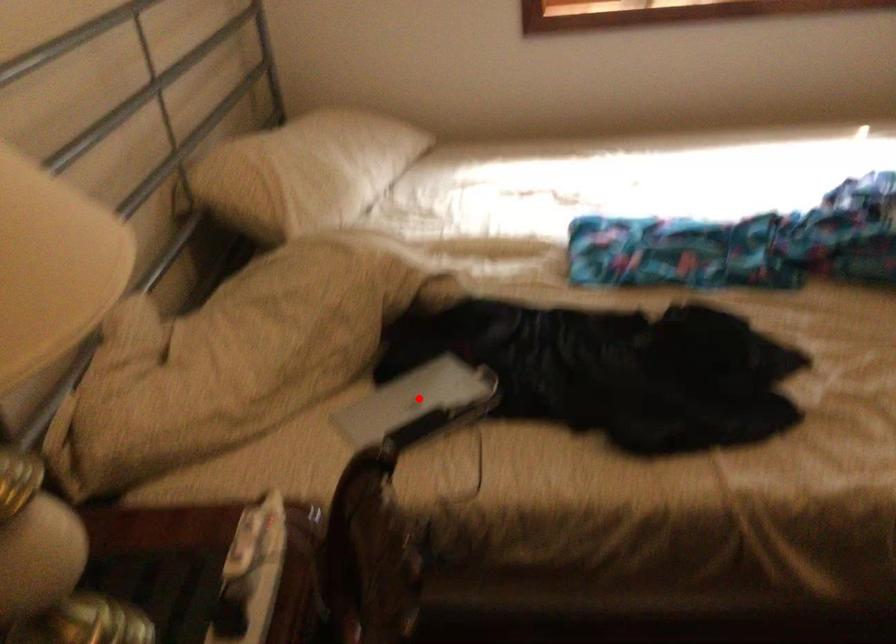
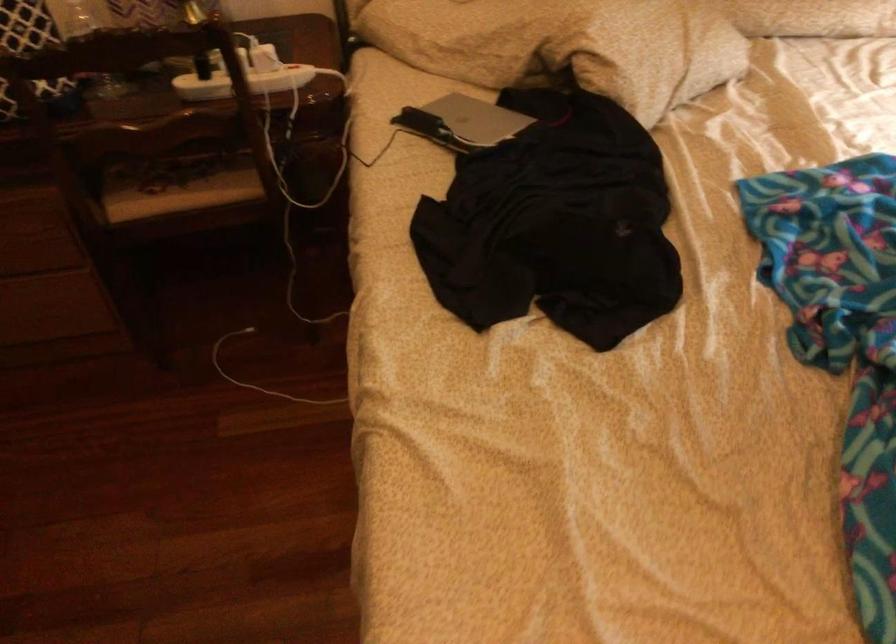
The point at the highlighted location is marked in the first image. Where is the corresponding point in the second image?

(477, 118)